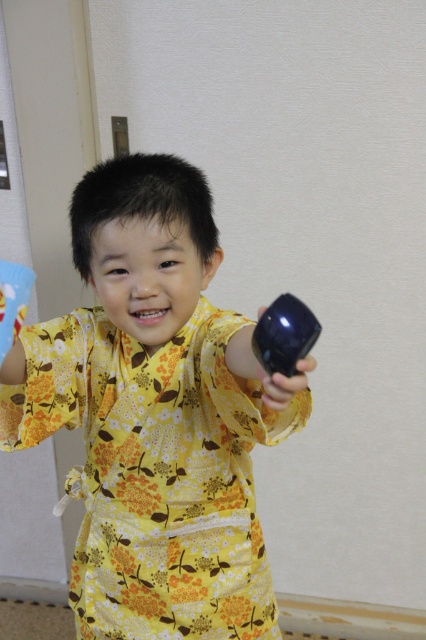
You are a photographer taking a picture of the child wearing the kimono. You notice two points in the image at coordinates point (203, 344) and point (293, 304). Which point is closer to your camera?

Point (203, 344) is further to the viewer than point (293, 304), so the point closer to the camera is point (293, 304).

The child is wearing a yellow floral kimono at center and holding a glossy plastic toy at right. Which item is taller?

The yellow floral kimono at center is taller than the glossy plastic toy at right.

Based on the scene description, where is the yellow floral kimono at center located in terms of its 2D coordinates?

The yellow floral kimono at center is located at the 2D coordinates of point [155,413].